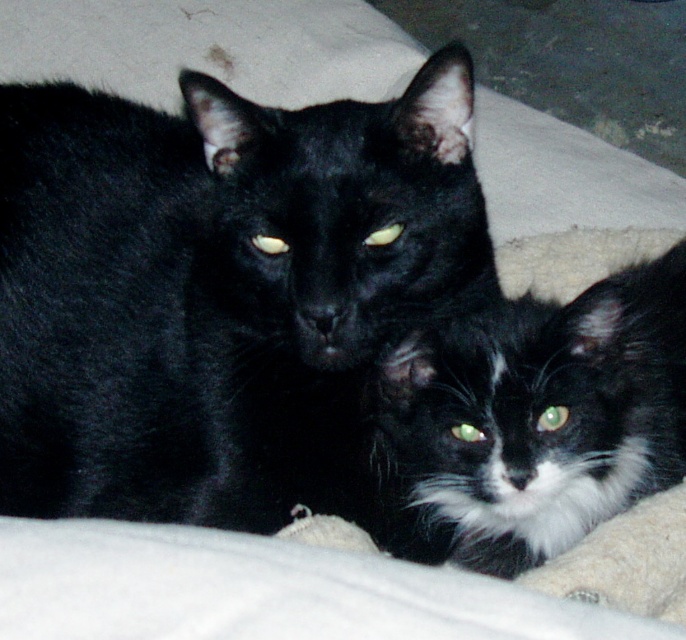
You are a cat owner who wants to place a cat tree in your living room. You have two cats, the black fur cat at center and the black fluffy cat at center. Which cat is taller?

The black fur cat at center is taller than the black fluffy cat at center.

You are a photographer trying to capture a closeup of the cats. Which cat should you focus on to ensure the black fur cat at center is in sharp focus while the black fluffy cat at center is slightly blurred?

You should focus on the black fur cat at center since it is closer to the viewer, ensuring it is in sharp focus while the black fluffy cat at center, being further away, will naturally appear slightly blurred.

You are a photographer trying to capture a closeup of both cats. Since you want to focus on the black fur cat at center and the black fluffy cat at center, which cat should you adjust your camera to the left to capture better?

The black fur cat at center is to the left of black fluffy cat at center, so adjusting the camera to the left would better capture the black fur cat at center.